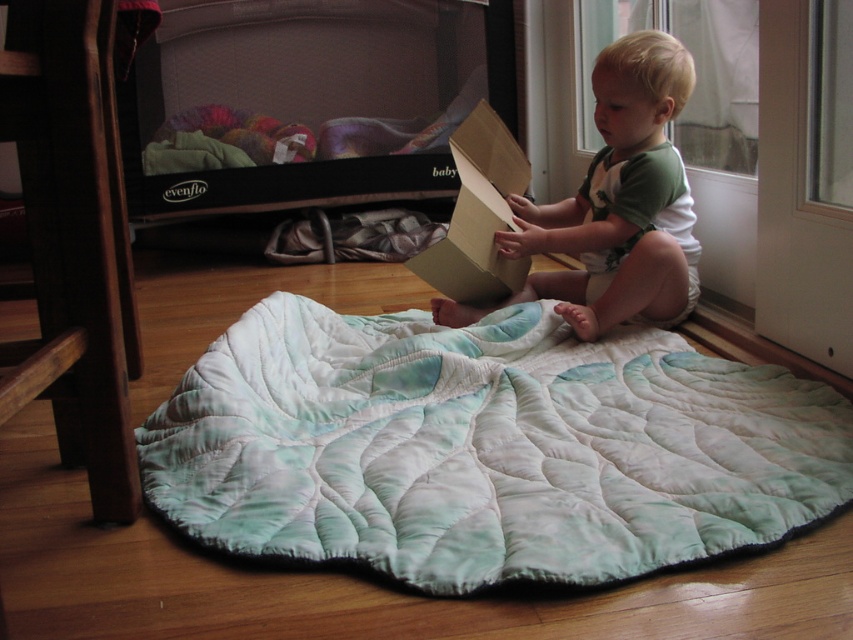
The child is sitting next to the fireplace and holding the brown cardboard box at center. There is also a mint quilted blanket at lower center nearby. Which object is bigger?

The mint quilted blanket at lower center is larger in size than the brown cardboard box at center.

You are a parent trying to place a toy on the floor near the child. The toy needs to be placed 0.5 units to the right and 0.3 units above the matte cardboard box at center. What are the coordinates where you should place the toy?

The coordinates for placing the toy would be calculated by adding 0.5 to the x coordinate and 0.3 to the y coordinate of the matte cardboard box at center. The new coordinates would be x 0.320 0.5 0.820, y 0.722 0.3 1.022. However, since the y coordinate exceeds 1.022, it might be outside the image bounds. Please adjust accordingly.

You are a parent trying to organize toys for your child. You have two boxes, the matte cardboard box at center and the brown cardboard box at center. If you want to place them side by side on a shelf that is 35 centimeters wide, will they fit?

The distance between the matte cardboard box at center and brown cardboard box at center is 17.84 centimeters. Since the shelf is 35 centimeters wide, which is double the distance between them, they will fit side by side on the shelf.